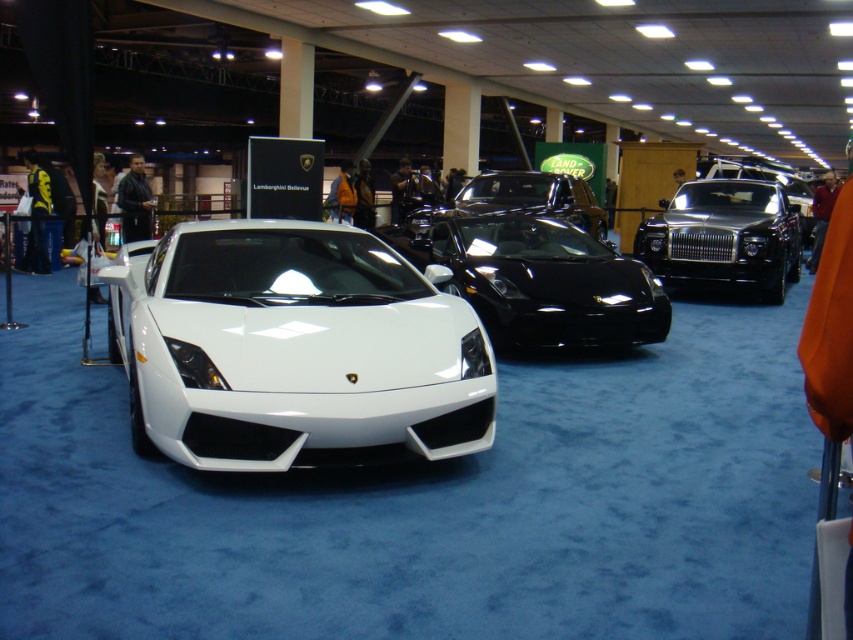
Can you confirm if white glossy sports car at center is shorter than glossy black car at center?

No, white glossy sports car at center is not shorter than glossy black car at center.

Identify the location of white glossy sports car at center. The width and height of the screenshot is (853, 640). (296, 349).

In the scene shown: Is black metallic sedan at right bigger than glossy black car at center?

No.

Does black metallic sedan at right appear under glossy black car at center?

Yes, black metallic sedan at right is below glossy black car at center.

In order to click on black metallic sedan at right in this screenshot , I will do `click(724, 236)`.

Find the location of a particular element. This screenshot has height=640, width=853. black metallic sedan at right is located at coordinates (724, 236).

Between white glossy sports car at center and black metallic sedan at right, which one appears on the right side from the viewer's perspective?

From the viewer's perspective, black metallic sedan at right appears more on the right side.

Which of these two, white glossy sports car at center or black metallic sedan at right, stands taller?

Standing taller between the two is black metallic sedan at right.

Does point (241, 461) come farther from viewer compared to point (793, 252)?

No, (241, 461) is closer to viewer.

Image resolution: width=853 pixels, height=640 pixels. I want to click on white glossy sports car at center, so click(296, 349).